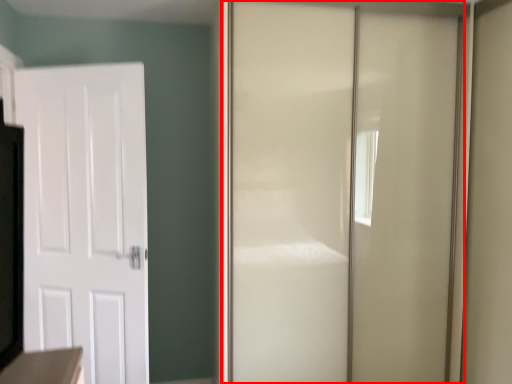
Question: From the image's perspective, considering the relative positions of door (annotated by the red box) and door in the image provided, where is door (annotated by the red box) located with respect to the staircase?

Choices:
 (A) below
 (B) above

Answer: (B)